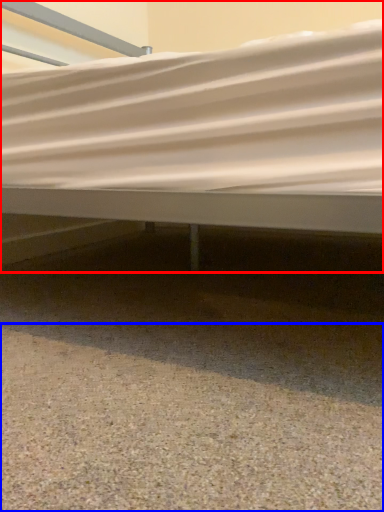
Question: Which object appears closest to the camera in this image, bed (highlighted by a red box) or gravel (highlighted by a blue box)?

Choices:
 (A) bed
 (B) gravel

Answer: (B)